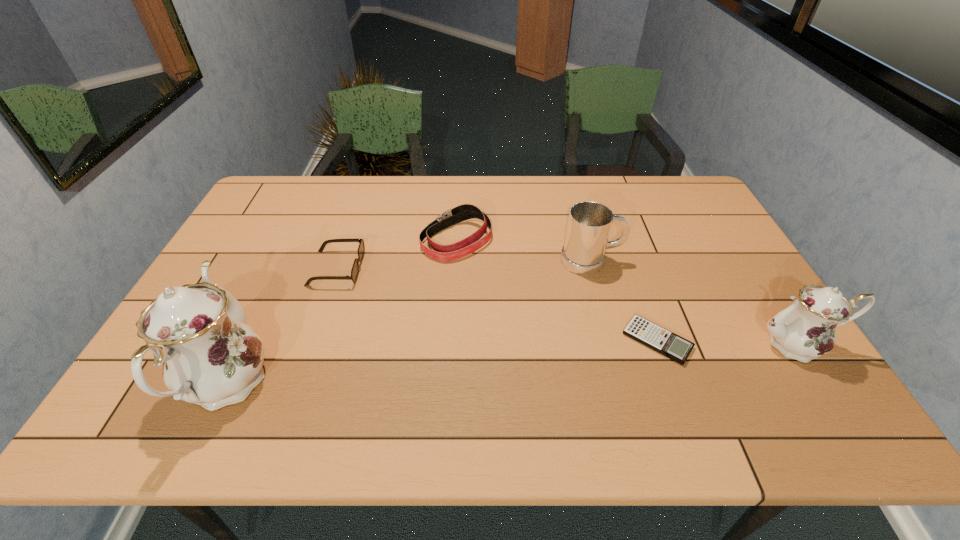
This screenshot has width=960, height=540. In the image, there is a desktop. In order to click on vacant space at the far edge in this screenshot , I will do `click(376, 190)`.

Where is `free space at the near edge of the desktop`? The height and width of the screenshot is (540, 960). free space at the near edge of the desktop is located at coordinates (399, 372).

Where is `free region at the right edge of the desktop`? free region at the right edge of the desktop is located at coordinates (764, 318).

Locate an element on the screen. The height and width of the screenshot is (540, 960). vacant space at the far left corner is located at coordinates pos(272,202).

The width and height of the screenshot is (960, 540). I want to click on vacant space at the far right corner of the desktop, so [x=696, y=208].

This screenshot has height=540, width=960. Identify the location of vacant space at the near right corner of the desktop. (758, 381).

This screenshot has width=960, height=540. I want to click on vacant area that lies between the fourth tallest object and the right chinaware, so click(627, 292).

The height and width of the screenshot is (540, 960). In order to click on blank region between the third object from left to right and the mug in this screenshot , I will do `click(524, 251)`.

Find the location of a particular element. The height and width of the screenshot is (540, 960). free area in between the sunglasses and the rightmost object is located at coordinates (566, 306).

The height and width of the screenshot is (540, 960). In order to click on free space between the taller chinaware and the rightmost object in this screenshot , I will do `click(511, 363)`.